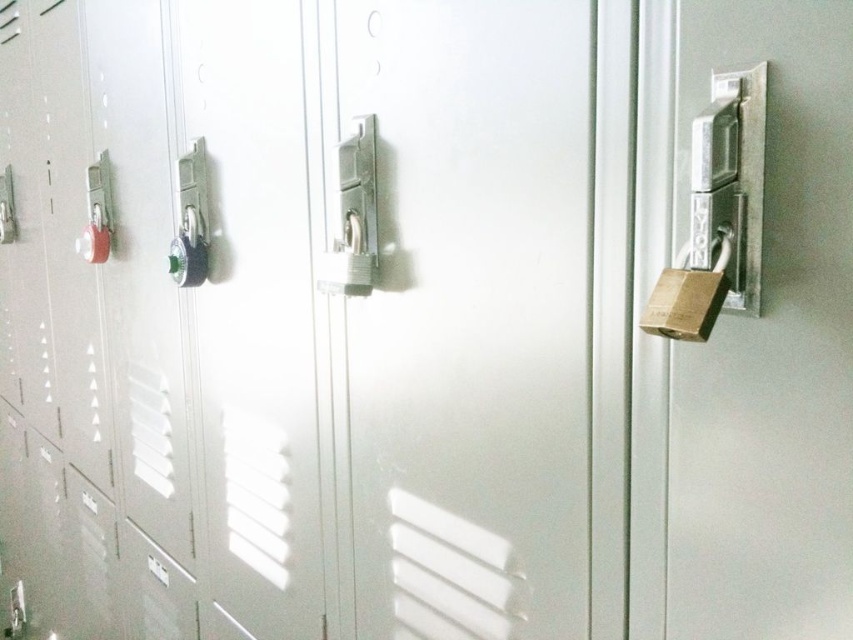
Question: Which point is closer to the camera?

Choices:
 (A) (x=703, y=316)
 (B) (x=366, y=224)

Answer: (A)

Question: Among these objects, which one is nearest to the camera?

Choices:
 (A) matte plastic door handle at left
 (B) gold metallic padlock at right
 (C) green plastic door handle at center
 (D) metallic silver lock at center

Answer: (B)

Question: Is gold metallic padlock at right positioned at the back of green plastic door handle at center?

Choices:
 (A) no
 (B) yes

Answer: (A)

Question: In this image, where is metallic silver lock at center located relative to matte plastic door handle at left?

Choices:
 (A) above
 (B) below

Answer: (B)

Question: Among these points, which one is nearest to the camera?

Choices:
 (A) (97, 168)
 (B) (207, 266)
 (C) (339, 195)
 (D) (722, 285)

Answer: (D)

Question: Can you confirm if metallic silver lock at center is wider than matte plastic door handle at left?

Choices:
 (A) no
 (B) yes

Answer: (A)